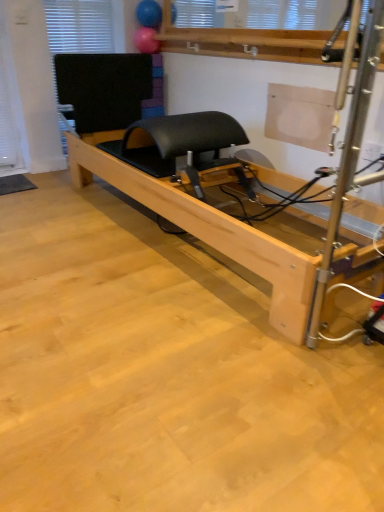
Question: Does black matte window at upper left come behind natural wood pilates reformer at center?

Choices:
 (A) no
 (B) yes

Answer: (B)

Question: Is black matte window at upper left facing away from natural wood pilates reformer at center?

Choices:
 (A) yes
 (B) no

Answer: (B)

Question: Is natural wood pilates reformer at center surrounded by black matte window at upper left?

Choices:
 (A) yes
 (B) no

Answer: (B)

Question: Is black matte window at upper left wider than natural wood pilates reformer at center?

Choices:
 (A) yes
 (B) no

Answer: (B)

Question: From the image's perspective, would you say black matte window at upper left is positioned over natural wood pilates reformer at center?

Choices:
 (A) yes
 (B) no

Answer: (A)

Question: Is black matte window at upper left aimed at natural wood pilates reformer at center?

Choices:
 (A) yes
 (B) no

Answer: (A)

Question: Considering the relative positions of rubber ball at upper center, which is the 2th balloon from top to bottom, and natural wood pilates reformer at center in the image provided, is rubber ball at upper center, which is the 2th balloon from top to bottom, to the left of natural wood pilates reformer at center from the viewer's perspective?

Choices:
 (A) no
 (B) yes

Answer: (B)

Question: Can you confirm if rubber ball at upper center, positioned as the first balloon in bottom-to-top order, is positioned to the right of natural wood pilates reformer at center?

Choices:
 (A) yes
 (B) no

Answer: (B)

Question: From the image's perspective, is rubber ball at upper center, positioned as the first balloon in bottom-to-top order, over natural wood pilates reformer at center?

Choices:
 (A) yes
 (B) no

Answer: (A)

Question: From a real-world perspective, is rubber ball at upper center, which is the 2th balloon from top to bottom, physically below natural wood pilates reformer at center?

Choices:
 (A) yes
 (B) no

Answer: (B)

Question: Considering the relative sizes of rubber ball at upper center, which is the 2th balloon from top to bottom, and natural wood pilates reformer at center in the image provided, is rubber ball at upper center, which is the 2th balloon from top to bottom, wider than natural wood pilates reformer at center?

Choices:
 (A) no
 (B) yes

Answer: (A)

Question: Considering the relative sizes of rubber ball at upper center, positioned as the first balloon in bottom-to-top order, and natural wood pilates reformer at center in the image provided, is rubber ball at upper center, positioned as the first balloon in bottom-to-top order, thinner than natural wood pilates reformer at center?

Choices:
 (A) yes
 (B) no

Answer: (A)

Question: Is black rubber yoga mat at lower left positioned with its back to rubberized blue ball at upper center, positioned as the second balloon in bottom-to-top order?

Choices:
 (A) no
 (B) yes

Answer: (A)